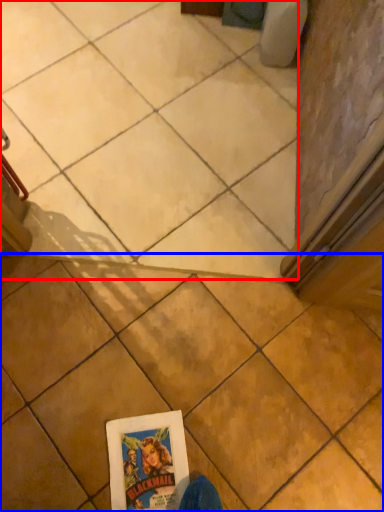
Question: Which of the following is the farthest to the observer, tile (highlighted by a red box) or tile (highlighted by a blue box)?

Choices:
 (A) tile
 (B) tile

Answer: (A)